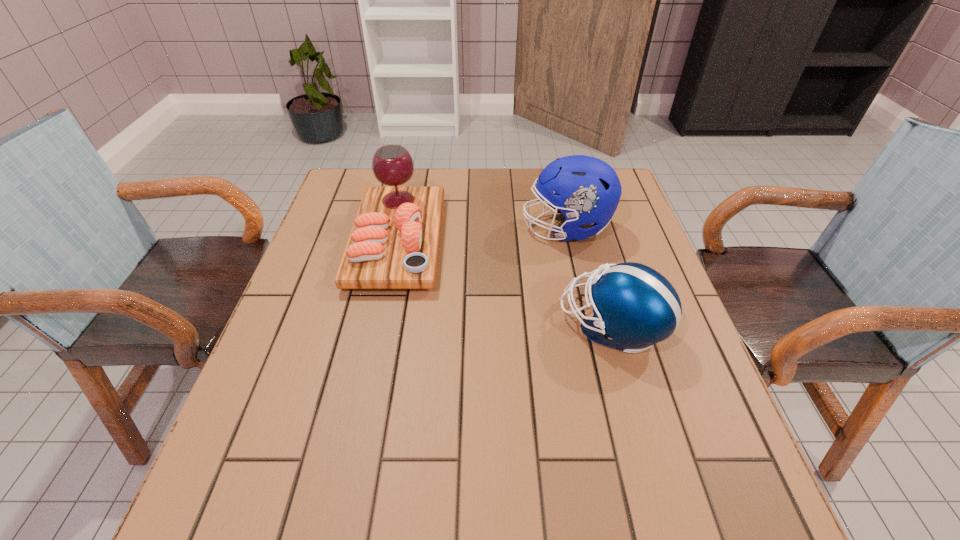
In order to click on vacant position at the near right corner of the desktop in this screenshot , I will do `click(710, 510)`.

Locate an element on the screen. The height and width of the screenshot is (540, 960). vacant space that is in between the platter and the farther football helmet is located at coordinates (482, 235).

I want to click on empty space that is in between the platter and the farther football helmet, so click(x=482, y=235).

Where is `vacant area that lies between the platter and the nearer football helmet`? Image resolution: width=960 pixels, height=540 pixels. vacant area that lies between the platter and the nearer football helmet is located at coordinates (505, 284).

Locate an element on the screen. The width and height of the screenshot is (960, 540). vacant space in between the platter and the nearer football helmet is located at coordinates (505, 284).

Where is `free space between the nearer football helmet and the leftmost object`? free space between the nearer football helmet and the leftmost object is located at coordinates (505, 284).

I want to click on free space between the platter and the farther football helmet, so click(482, 235).

Where is `the closest object to the farther football helmet`? Image resolution: width=960 pixels, height=540 pixels. the closest object to the farther football helmet is located at coordinates coord(634,306).

Select which object appears as the closest to the leftmost object. Please provide its 2D coordinates. Your answer should be formatted as a tuple, i.e. [(x, y)], where the tuple contains the x and y coordinates of a point satisfying the conditions above.

[(587, 190)]